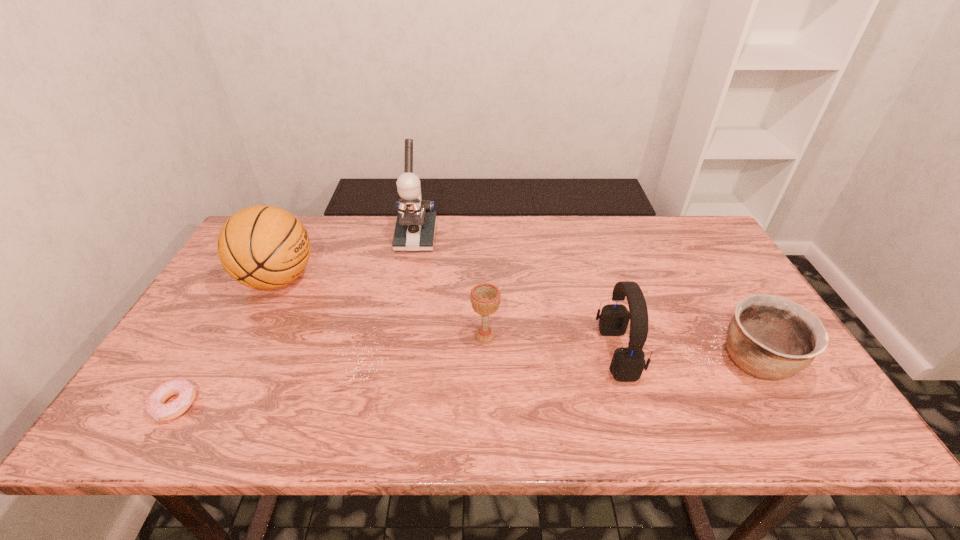
Find the location of a particular element. the tallest object is located at coordinates (415, 227).

You are a GUI agent. You are given a task and a screenshot of the screen. Output one action in this format:
    pyautogui.click(x=<x>, y=<y>)
    Task: Click on the farthest object
    Image resolution: width=960 pixels, height=540 pixels.
    Given the screenshot: What is the action you would take?
    pyautogui.click(x=415, y=227)

This screenshot has width=960, height=540. I want to click on basketball, so click(x=263, y=247).

Locate an element on the screen. Image resolution: width=960 pixels, height=540 pixels. headset is located at coordinates (628, 363).

Identify the location of the third object from right to left. click(x=485, y=298).

You are a GUI agent. You are given a task and a screenshot of the screen. Output one action in this format:
    pyautogui.click(x=<x>, y=<y>)
    Task: Click on the rightmost object
    This screenshot has width=960, height=540.
    Given the screenshot: What is the action you would take?
    pyautogui.click(x=770, y=337)

Find the location of `the shortest object`. the shortest object is located at coordinates (155, 406).

What are the coordinates of `vacant region located 0.300m at the eyepiece of the farthest object` in the screenshot? It's located at (399, 322).

Locate an element on the screen. The height and width of the screenshot is (540, 960). blank space located on the surface of the basketball near the brand logo is located at coordinates (423, 279).

Where is `vacant space located on the headband of the headset`? The image size is (960, 540). vacant space located on the headband of the headset is located at coordinates [571, 353].